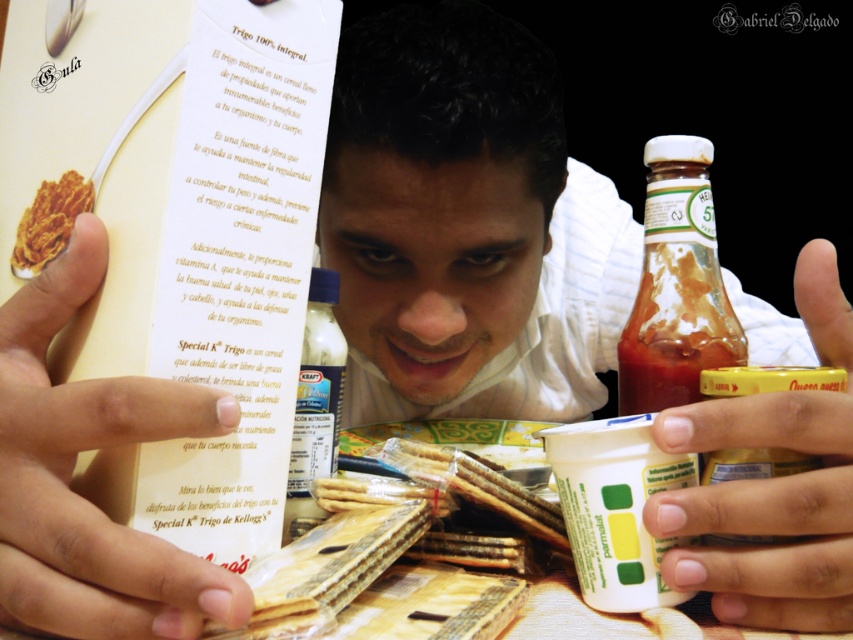
You are a food safety inspector examining the image. You notice the white matte finger at center and the crispy golden cereal at center. Which object is larger in size?

The white matte finger at center is bigger than the crispy golden cereal at center.

You are a food safety inspector checking the arrangement of items on the table. You notice the white matte finger at center and the crispy golden cereal at center. Which object is positioned above the other?

The crispy golden cereal at center is positioned above the white matte finger at center because the white matte finger at center is below crispy golden cereal at center.